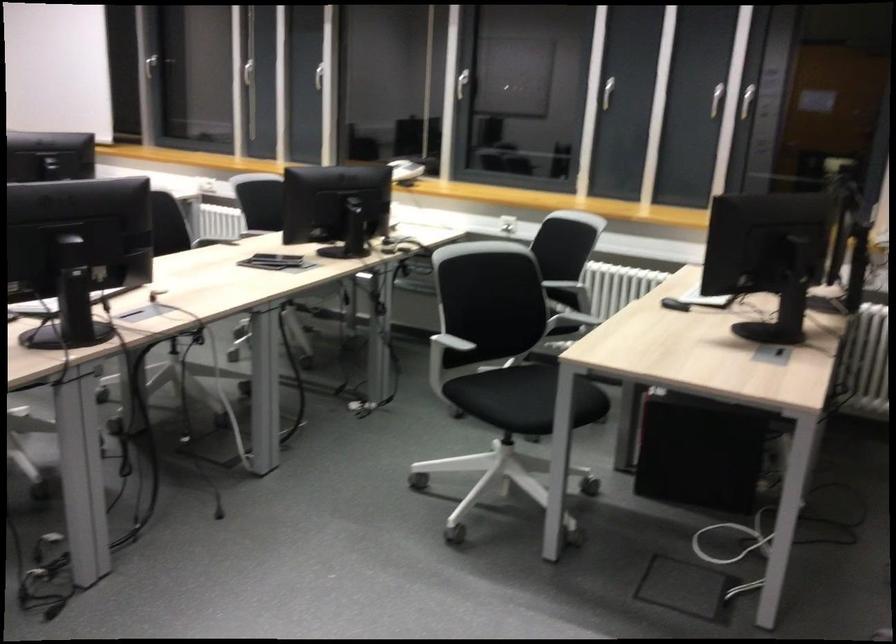
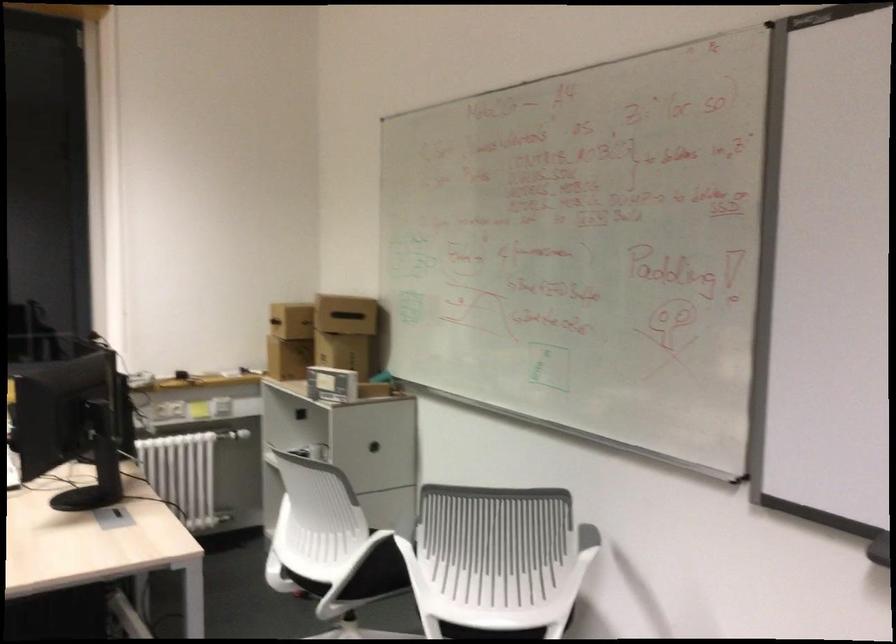
Question: The first image is from the beginning of the video and the second image is from the end. How did the camera likely rotate when shooting the video?

Choices:
 (A) Left
 (B) Right
 (C) Up
 (D) Down

Answer: (B)